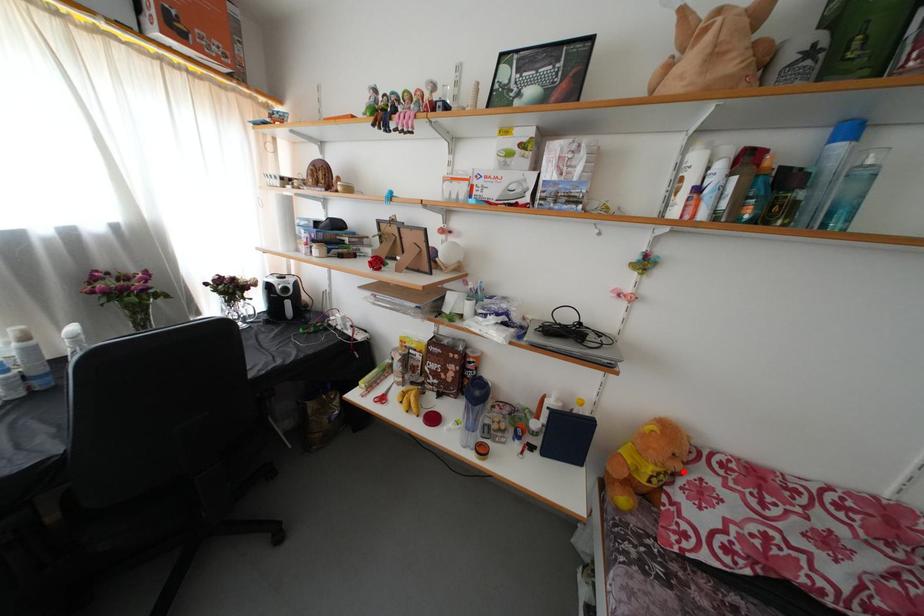
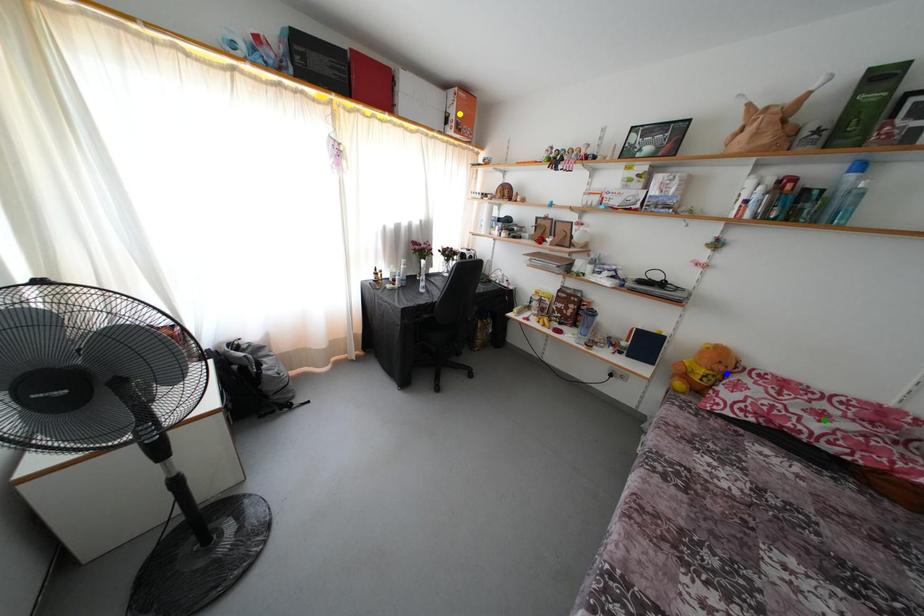
Question: I am providing you with two images of the same scene from different viewpoints. A red point is marked on the first image. You are given multiple points on the second image. Which point in image 2 represents the same 3d spot as the red point in image 1?

Choices:
 (A) blue point
 (B) green point
 (C) yellow point

Answer: (A)